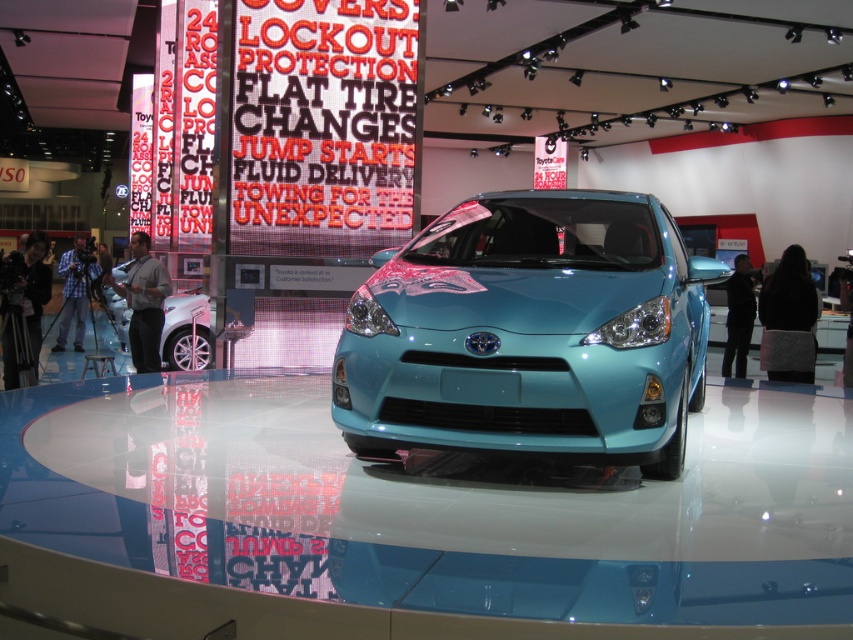
You are a photographer at the auto show and need to capture both the teal glossy concept car at center and the matte black car at left in a single shot. Based on their positions, which car should you focus on first to ensure both are in frame?

The teal glossy concept car at center is above the matte black car at left, so focusing on the teal glossy concept car at center first will ensure both are in frame as it is positioned higher up.

You are standing at the entrance of the auto show and want to locate the teal glossy concept car at center. According to the coordinates provided, where should you look to find it?

The teal glossy concept car at center is located at coordinates point (x=531, y=333).

Based on the photo, you are a photographer at the auto show and need to capture both the teal glossy concept car at center and the matte black car at left in a single shot. Based on their positions, which car will appear larger in the photo?

The teal glossy concept car at center will appear larger in the photo because it is positioned in front of the matte black car at left, making it closer to the camera.